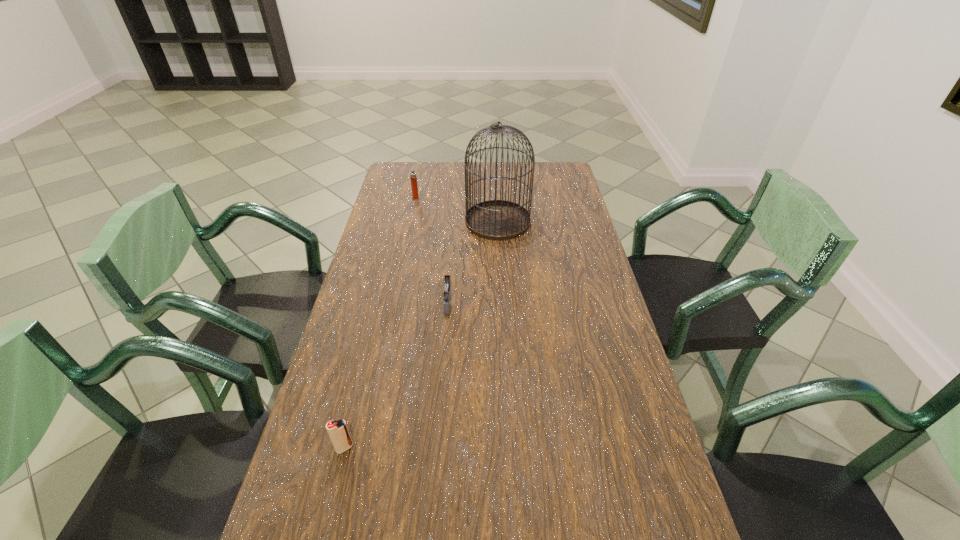
Locate an element on the screen. Image resolution: width=960 pixels, height=540 pixels. free spot located on the back of the second nearest igniter is located at coordinates (452, 254).

The image size is (960, 540). Identify the location of vacant region located on the right of the nearest igniter. (454, 448).

Identify the location of vacant space at the far edge of the desktop. (437, 166).

This screenshot has height=540, width=960. In order to click on vacant space at the left edge of the desktop in this screenshot , I will do `click(373, 280)`.

This screenshot has width=960, height=540. Identify the location of free space at the right edge. (545, 240).

The width and height of the screenshot is (960, 540). What are the coordinates of `free space at the far right corner of the desktop` in the screenshot? It's located at (535, 178).

Locate an element on the screen. Image resolution: width=960 pixels, height=540 pixels. free point between the nearest object and the rightmost object is located at coordinates (421, 335).

Where is `free space that is in between the leftmost object and the tallest object`? Image resolution: width=960 pixels, height=540 pixels. free space that is in between the leftmost object and the tallest object is located at coordinates (421, 335).

At what (x,y) coordinates should I click in order to perform the action: click on vacant area that lies between the second object from right to left and the leftmost object. Please return your answer as a coordinate pair (x, y). Looking at the image, I should click on (396, 375).

Image resolution: width=960 pixels, height=540 pixels. Identify the location of empty location between the tallest object and the leftmost igniter. (421, 335).